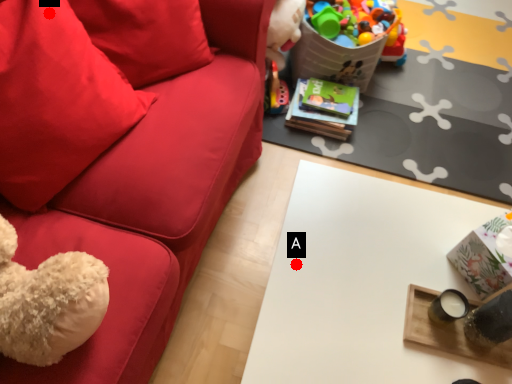
Question: Two points are circled on the image, labeled by A and B beside each circle. Which of the following is the farthest from the observer?

Choices:
 (A) A is further
 (B) B is further

Answer: (B)